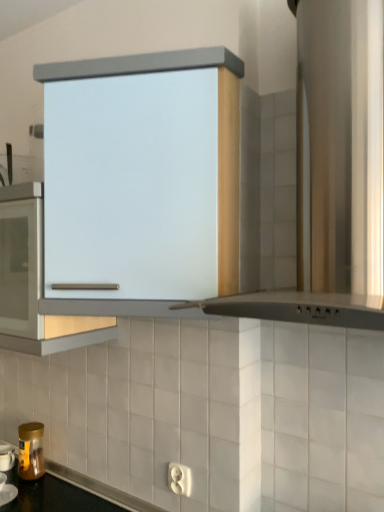
Question: Can you confirm if satin silver hood at upper center is bigger than satin white cabinet at center?

Choices:
 (A) no
 (B) yes

Answer: (B)

Question: Is satin silver hood at upper center facing away from satin white cabinet at center?

Choices:
 (A) yes
 (B) no

Answer: (B)

Question: Is satin silver hood at upper center shorter than satin white cabinet at center?

Choices:
 (A) yes
 (B) no

Answer: (B)

Question: Is satin silver hood at upper center oriented towards satin white cabinet at center?

Choices:
 (A) yes
 (B) no

Answer: (B)

Question: From a real-world perspective, is satin silver hood at upper center located beneath satin white cabinet at center?

Choices:
 (A) yes
 (B) no

Answer: (B)

Question: Is point (28, 438) positioned closer to the camera than point (301, 215)?

Choices:
 (A) farther
 (B) closer

Answer: (A)

Question: Considering the positions of gold metallic jar at lower left and satin silver hood at upper center in the image, is gold metallic jar at lower left wider or thinner than satin silver hood at upper center?

Choices:
 (A) wide
 (B) thin

Answer: (B)

Question: From a real-world perspective, is gold metallic jar at lower left positioned above or below satin silver hood at upper center?

Choices:
 (A) below
 (B) above

Answer: (A)

Question: In the image, is gold metallic jar at lower left positioned in front of or behind satin silver hood at upper center?

Choices:
 (A) front
 (B) behind

Answer: (B)

Question: Looking at the image, does satin silver hood at upper center seem bigger or smaller compared to gold metallic jar at lower left?

Choices:
 (A) small
 (B) big

Answer: (B)

Question: Would you say satin silver hood at upper center is inside or outside gold metallic jar at lower left?

Choices:
 (A) inside
 (B) outside

Answer: (B)

Question: Considering their positions, is satin silver hood at upper center located in front of or behind gold metallic jar at lower left?

Choices:
 (A) behind
 (B) front

Answer: (B)

Question: Would you say satin silver hood at upper center is to the left or to the right of gold metallic jar at lower left in the picture?

Choices:
 (A) left
 (B) right

Answer: (B)

Question: Is satin silver hood at upper center wider or thinner than satin white cabinet at center?

Choices:
 (A) thin
 (B) wide

Answer: (B)

Question: In the image, is satin silver hood at upper center positioned in front of or behind satin white cabinet at center?

Choices:
 (A) front
 (B) behind

Answer: (A)